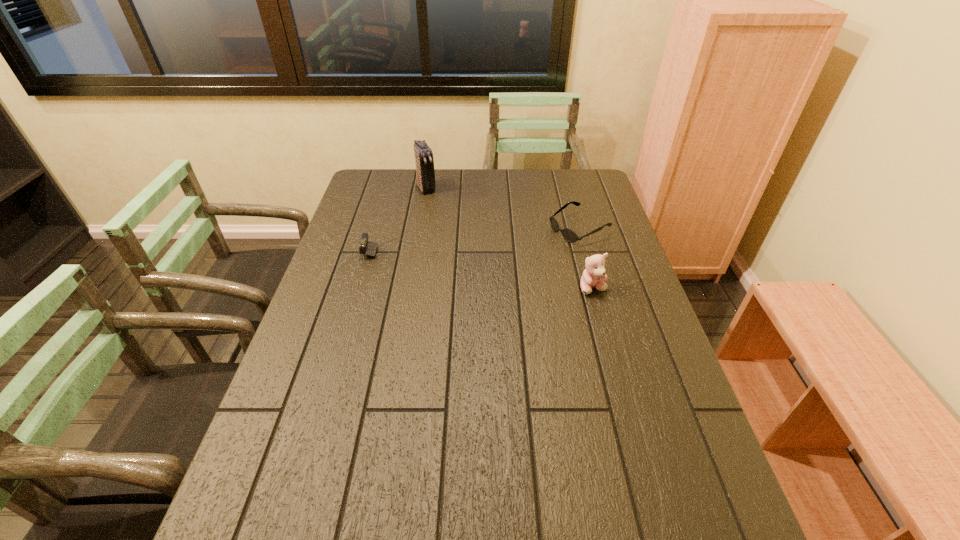
You are a GUI agent. You are given a task and a screenshot of the screen. Output one action in this format:
    pyautogui.click(x=<x>, y=<y>)
    Task: Click on the vacant space on the desktop that is between the webcam and the second tallest object and is positioned with the zip open on the tallest object
    The height and width of the screenshot is (540, 960).
    Given the screenshot: What is the action you would take?
    pyautogui.click(x=478, y=266)

Find the location of `vacant space on the desktop that is between the webcam and the nearest object and is positioned on the lenses of the sunglasses`. vacant space on the desktop that is between the webcam and the nearest object and is positioned on the lenses of the sunglasses is located at coordinates (492, 268).